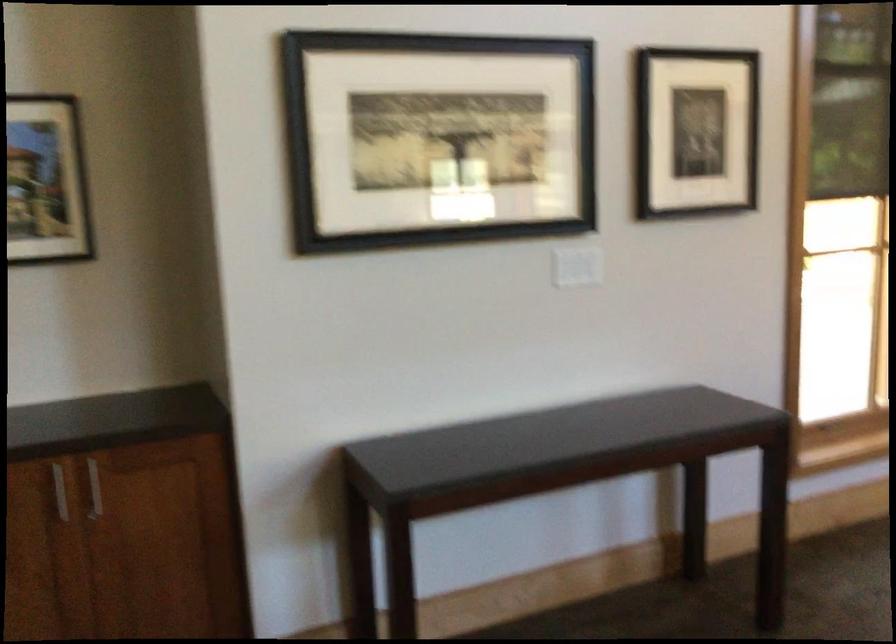
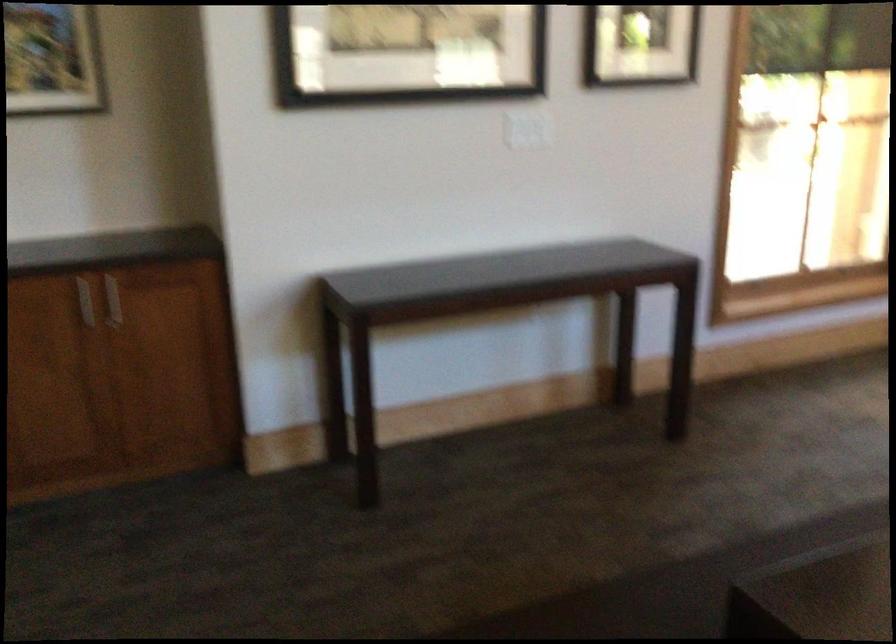
Question: The first image is from the beginning of the video and the second image is from the end. How did the camera likely rotate when shooting the video?

Choices:
 (A) Left
 (B) Right
 (C) Up
 (D) Down

Answer: (D)